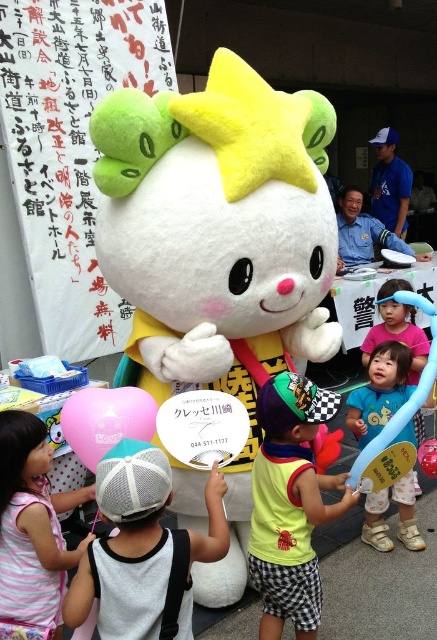
Can you confirm if blue fabric hat at lower right is positioned below blue fabric cap at upper center?

Yes, blue fabric hat at lower right is below blue fabric cap at upper center.

The width and height of the screenshot is (437, 640). In order to click on blue fabric hat at lower right in this screenshot , I will do `click(396, 328)`.

Find the location of a particular element. blue fabric hat at lower right is located at coordinates pyautogui.click(x=396, y=328).

Can you confirm if blue fabric balloon at lower right is positioned to the left of blue fabric cap at upper center?

Correct, you'll find blue fabric balloon at lower right to the left of blue fabric cap at upper center.

Who is positioned more to the right, blue fabric balloon at lower right or blue fabric cap at upper center?

blue fabric cap at upper center

Which is in front, point (388, 500) or point (391, 132)?

Point (388, 500) is more forward.

Find the location of a particular element. blue fabric balloon at lower right is located at coordinates (380, 392).

Can you confirm if yellow fabric shirt at center is positioned above blue fabric hat at lower right?

No, yellow fabric shirt at center is not above blue fabric hat at lower right.

Who is positioned more to the right, yellow fabric shirt at center or blue fabric hat at lower right?

blue fabric hat at lower right

Between point (298, 556) and point (378, 339), which one is positioned behind?

Point (378, 339)

Where is `yellow fabric shirt at center`? yellow fabric shirt at center is located at coordinates (290, 502).